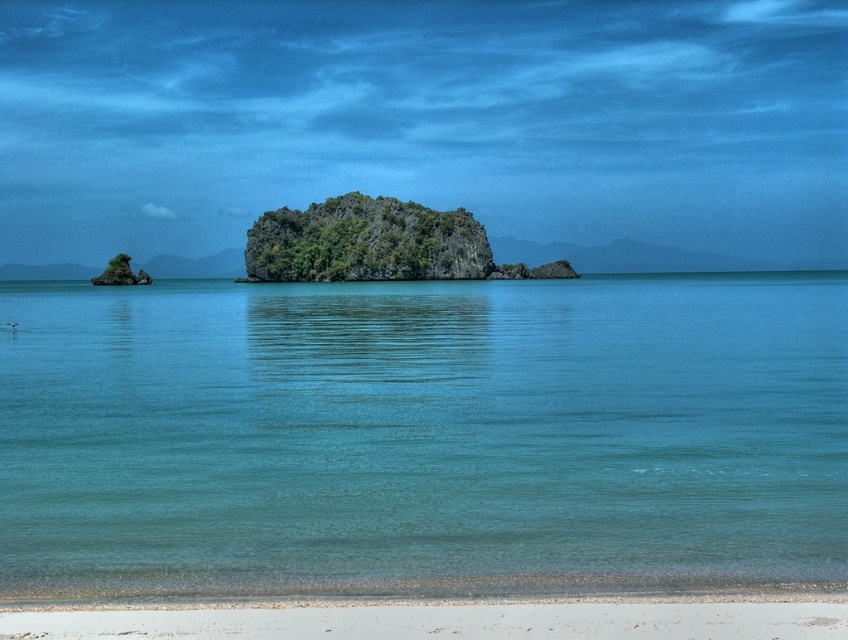
You are a beachgoer planning to swim in the clear blue water at lower center and relax on the white sandy beach at lower center. Which area has a bigger space for you to enjoy?

The clear blue water at lower center is larger in size than the white sandy beach at lower center, so the clear blue water at lower center has a bigger space for you to enjoy.

You are standing on the white sandy beach at lower center and want to reach the rocky island in the distance. Which direction should you walk to get to the island first, towards the clear blue water at lower center or away from it?

You should walk towards the clear blue water at lower center because it is taller than the white sandy beach at lower center, indicating it is closer to the island.

You are standing on the white sandy beach at lower center and want to reach the calm body of water. According to the scene, which direction should you move to get to the clear blue water at lower center?

The clear blue water at lower center is located above the white sandy beach at lower center, so you should move upward from the white sandy beach at lower center to reach it.